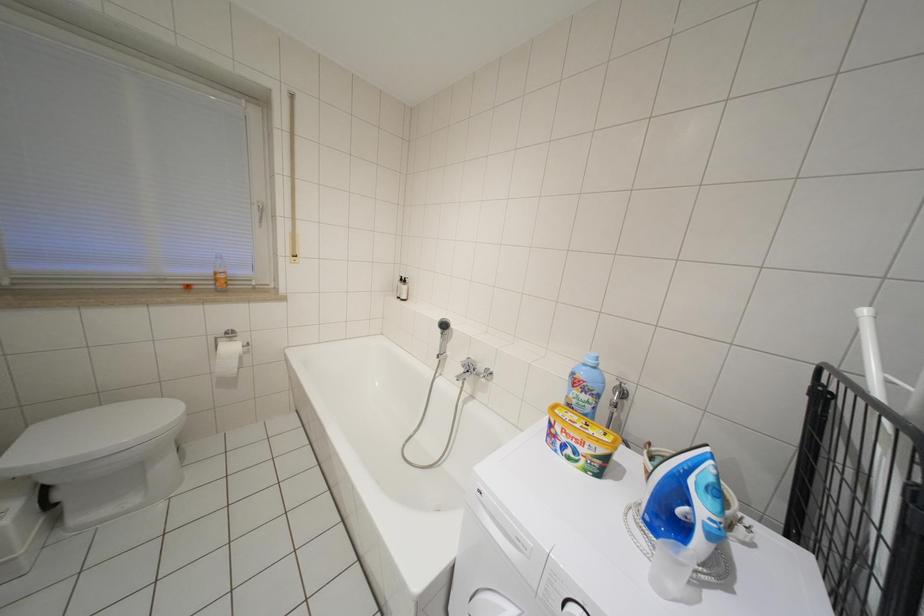
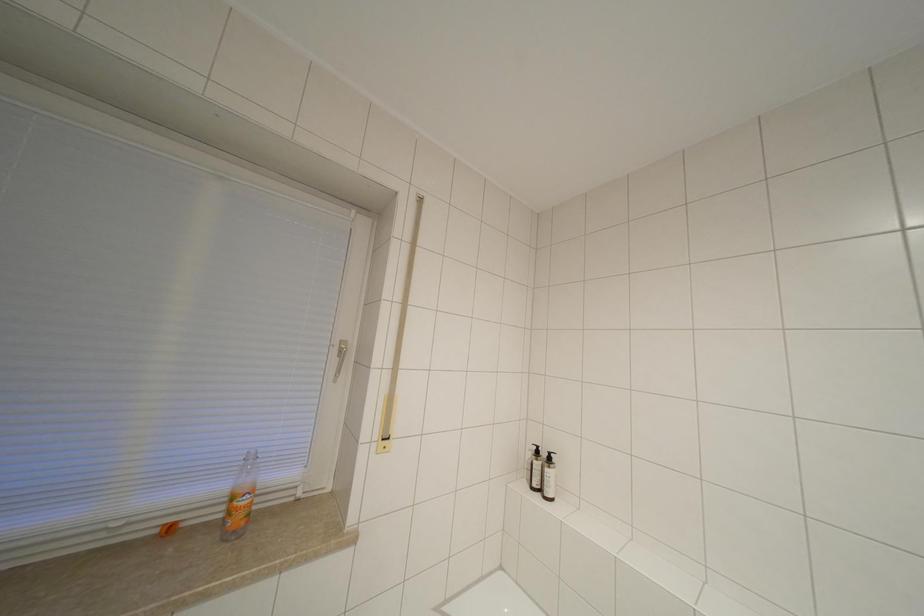
In a continuous first-person perspective shot, in which direction is the camera moving?

The cameraman walked toward left, forward.